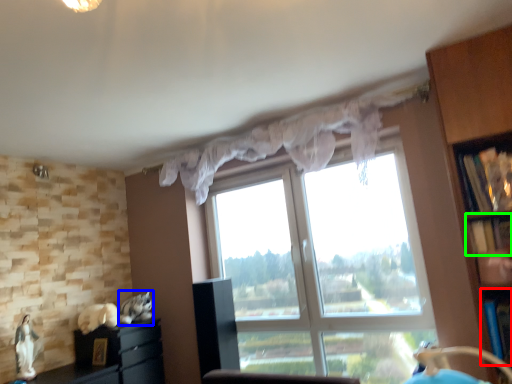
Question: Based on their relative distances, which object is nearer to shelf (highlighted by a red box)? Choose from animal (highlighted by a blue box) and shelf (highlighted by a green box).

Choices:
 (A) animal
 (B) shelf

Answer: (B)